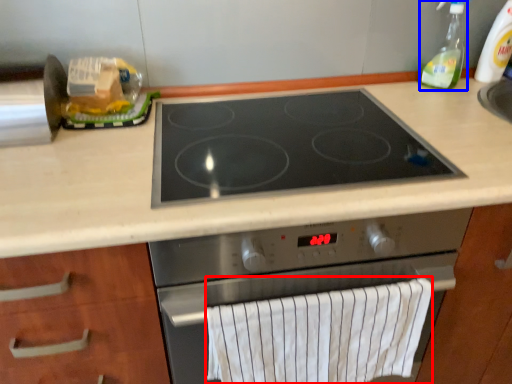
Question: Which object appears closest to the camera in this image, bath towel (highlighted by a red box) or soap dispenser (highlighted by a blue box)?

Choices:
 (A) bath towel
 (B) soap dispenser

Answer: (A)